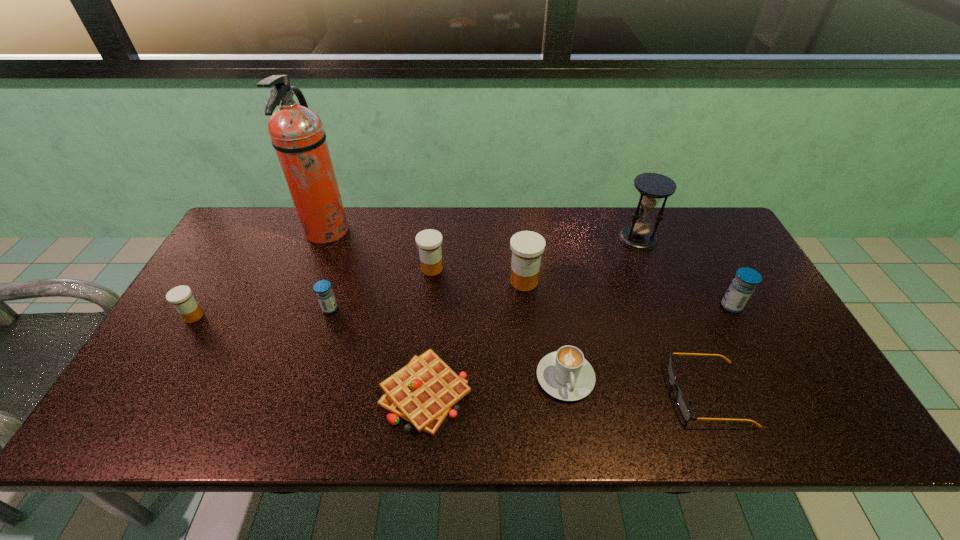
Image resolution: width=960 pixels, height=540 pixels. What are the coordinates of `fire extinguisher situated at the far edge` in the screenshot? It's located at (297, 134).

Where is `hourglass that is at the far edge`? hourglass that is at the far edge is located at coordinates (653, 187).

At what (x,y) coordinates should I click in order to perform the action: click on cappuccino that is at the near edge. Please return your answer as a coordinate pair (x, y). Looking at the image, I should click on (565, 374).

Locate an element on the screen. spectacles at the near edge is located at coordinates (681, 402).

Locate an element on the screen. The height and width of the screenshot is (540, 960). waffle that is at the near edge is located at coordinates (423, 392).

This screenshot has width=960, height=540. In order to click on object located in the left edge section of the desktop in this screenshot , I will do `click(181, 297)`.

I want to click on object that is at the right edge, so click(741, 288).

The width and height of the screenshot is (960, 540). In order to click on vacant space at the far edge of the desktop in this screenshot , I will do `click(394, 218)`.

Image resolution: width=960 pixels, height=540 pixels. What are the coordinates of `vacant space at the near edge of the desktop` in the screenshot? It's located at (500, 430).

The height and width of the screenshot is (540, 960). What are the coordinates of `vacant space at the left edge of the desktop` in the screenshot? It's located at (178, 376).